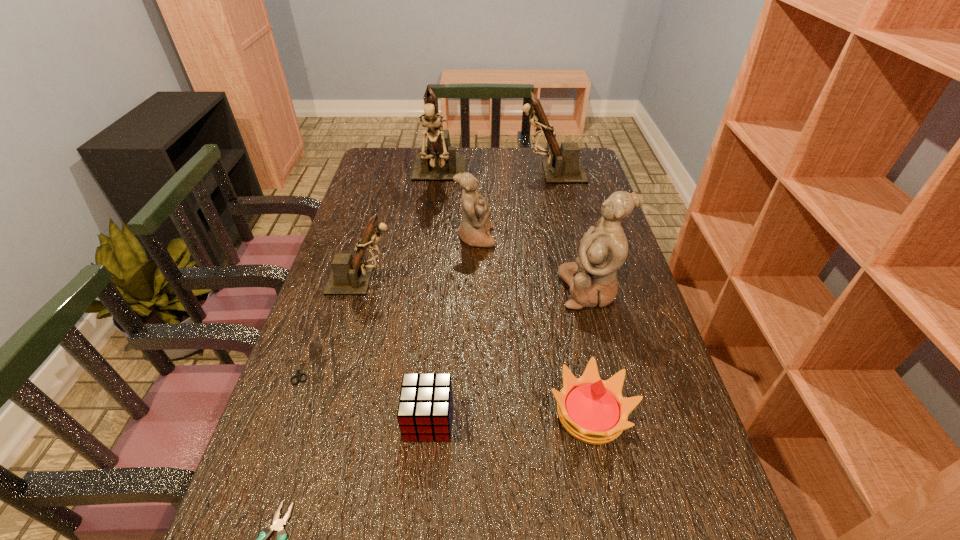
Identify the location of free space located 0.150m on the front-facing side of the right white figurine. (504, 290).

At what (x,y) coordinates should I click in order to perform the action: click on free location located on the front-facing side of the farther white figurine. Please return your answer as a coordinate pair (x, y). Looking at the image, I should click on (576, 238).

This screenshot has width=960, height=540. I want to click on vacant space situated on the front-facing side of the nearest brown figurine, so click(x=534, y=280).

Locate an element on the screen. free space located on the left of the sixth tallest object is located at coordinates (390, 414).

The width and height of the screenshot is (960, 540). In order to click on vacant space located on the left of the cube in this screenshot , I will do tap(343, 420).

Where is `blank space located 0.270m on the back of the shears`? blank space located 0.270m on the back of the shears is located at coordinates (334, 273).

I want to click on figurine present at the left edge, so click(x=350, y=275).

The width and height of the screenshot is (960, 540). What are the coordinates of `shears at the left edge` in the screenshot? It's located at (298, 375).

You are a GUI agent. You are given a task and a screenshot of the screen. Output one action in this format:
    pyautogui.click(x=<x>, y=<y>)
    Task: Click on the crown situated at the right edge
    Image resolution: width=960 pixels, height=540 pixels.
    Given the screenshot: What is the action you would take?
    pyautogui.click(x=592, y=410)

Find the location of a particular element. object that is positioned at the far right corner is located at coordinates (565, 167).